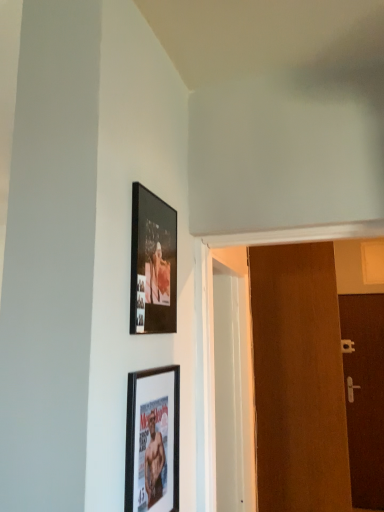
Describe the element at coordinates (364, 395) in the screenshot. I see `brown matte door at right, which appears as the second door when viewed from the left` at that location.

Where is `matte black picture frame at upper center, placed as the 1th picture frame when sorted from top to bottom`? matte black picture frame at upper center, placed as the 1th picture frame when sorted from top to bottom is located at coordinates (153, 264).

Where is `brown matte door at right, which appears as the second door when viewed from the left`? This screenshot has height=512, width=384. brown matte door at right, which appears as the second door when viewed from the left is located at coordinates (364, 395).

Does point (299, 401) come closer to viewer compared to point (154, 317)?

That is False.

From the picture: Is brown wooden door at right, the second door when ordered from right to left, inside or outside of matte black picture frame at upper center, the 2th picture frame in the bottom-to-top sequence?

brown wooden door at right, the second door when ordered from right to left, cannot be found inside matte black picture frame at upper center, the 2th picture frame in the bottom-to-top sequence.

Is brown wooden door at right, positioned as the 1th door in front-to-back order, to the left or to the right of matte black picture frame at upper center, placed as the 1th picture frame when sorted from top to bottom, in the image?

In the image, brown wooden door at right, positioned as the 1th door in front-to-back order, appears on the right side of matte black picture frame at upper center, placed as the 1th picture frame when sorted from top to bottom.

Which of these two, matte black picture frame at upper center, placed as the 1th picture frame when sorted from top to bottom, or matte black picture frame at lower center, marked as the 2th picture frame in a top-to-bottom arrangement, is wider?

With larger width is matte black picture frame at upper center, placed as the 1th picture frame when sorted from top to bottom.

Where is `picture frame that appears below the matte black picture frame at upper center, the 2th picture frame in the bottom-to-top sequence (from a real-world perspective)`? Image resolution: width=384 pixels, height=512 pixels. picture frame that appears below the matte black picture frame at upper center, the 2th picture frame in the bottom-to-top sequence (from a real-world perspective) is located at coordinates (152, 438).

Does matte black picture frame at upper center, the 2th picture frame in the bottom-to-top sequence, have a larger size compared to matte black picture frame at lower center, which is the first picture frame in bottom-to-top order?

Yes.

From the picture: Between matte black picture frame at lower center, marked as the 2th picture frame in a top-to-bottom arrangement, and matte black picture frame at upper center, the 2th picture frame in the bottom-to-top sequence, which one appears on the right side from the viewer's perspective?

Positioned to the right is matte black picture frame at lower center, marked as the 2th picture frame in a top-to-bottom arrangement.

Is the depth of matte black picture frame at lower center, which is the first picture frame in bottom-to-top order, greater than that of matte black picture frame at upper center, placed as the 1th picture frame when sorted from top to bottom?

No, it is in front of matte black picture frame at upper center, placed as the 1th picture frame when sorted from top to bottom.

Which of these two, matte black picture frame at lower center, which is the first picture frame in bottom-to-top order, or matte black picture frame at upper center, the 2th picture frame in the bottom-to-top sequence, is smaller?

matte black picture frame at lower center, which is the first picture frame in bottom-to-top order.

From the picture: Is matte black picture frame at lower center, which is the first picture frame in bottom-to-top order, located outside matte black picture frame at upper center, the 2th picture frame in the bottom-to-top sequence?

Yes, matte black picture frame at lower center, which is the first picture frame in bottom-to-top order, is located beyond the bounds of matte black picture frame at upper center, the 2th picture frame in the bottom-to-top sequence.

Does point (360, 294) appear closer or farther from the camera than point (149, 259)?

Clearly, point (360, 294) is more distant from the camera than point (149, 259).

Can you confirm if brown matte door at right, which appears as the second door when viewed from the left, is wider than matte black picture frame at upper center, placed as the 1th picture frame when sorted from top to bottom?

Indeed, brown matte door at right, which appears as the second door when viewed from the left, has a greater width compared to matte black picture frame at upper center, placed as the 1th picture frame when sorted from top to bottom.

You are a GUI agent. You are given a task and a screenshot of the screen. Output one action in this format:
    pyautogui.click(x=<x>, y=<y>)
    Task: Click on the picture frame that is the 1st one when counting forward from the brown matte door at right, which appears as the second door when viewed from the left
    Image resolution: width=384 pixels, height=512 pixels.
    Given the screenshot: What is the action you would take?
    pyautogui.click(x=153, y=264)

Can you confirm if brown matte door at right, the first door positioned from the right, is bigger than matte black picture frame at upper center, placed as the 1th picture frame when sorted from top to bottom?

Yes, brown matte door at right, the first door positioned from the right, is bigger than matte black picture frame at upper center, placed as the 1th picture frame when sorted from top to bottom.

Is matte black picture frame at upper center, placed as the 1th picture frame when sorted from top to bottom, facing away from brown wooden door at right, positioned as the 1th door in left-to-right order?

No, brown wooden door at right, positioned as the 1th door in left-to-right order, is not at the back of matte black picture frame at upper center, placed as the 1th picture frame when sorted from top to bottom.

Based on their positions, is matte black picture frame at upper center, the 2th picture frame in the bottom-to-top sequence, located to the left or right of brown wooden door at right, the second door when ordered from right to left?

matte black picture frame at upper center, the 2th picture frame in the bottom-to-top sequence, is positioned on brown wooden door at right, the second door when ordered from right to left,'s left side.

Is matte black picture frame at upper center, placed as the 1th picture frame when sorted from top to bottom, surrounding brown wooden door at right, positioned as the 1th door in left-to-right order?

No, matte black picture frame at upper center, placed as the 1th picture frame when sorted from top to bottom, does not contain brown wooden door at right, positioned as the 1th door in left-to-right order.

Measure the distance between matte black picture frame at upper center, placed as the 1th picture frame when sorted from top to bottom, and brown wooden door at right, marked as the 2th door in a back-to-front arrangement.

matte black picture frame at upper center, placed as the 1th picture frame when sorted from top to bottom, is 1.55 meters from brown wooden door at right, marked as the 2th door in a back-to-front arrangement.

The height and width of the screenshot is (512, 384). What are the coordinates of `door that is the 1st one when counting rightward from the matte black picture frame at lower center, marked as the 2th picture frame in a top-to-bottom arrangement` in the screenshot? It's located at (298, 380).

Is matte black picture frame at lower center, which is the first picture frame in bottom-to-top order, shorter than brown wooden door at right, marked as the 2th door in a back-to-front arrangement?

Correct, matte black picture frame at lower center, which is the first picture frame in bottom-to-top order, is not as tall as brown wooden door at right, marked as the 2th door in a back-to-front arrangement.

From the image's perspective, between matte black picture frame at lower center, which is the first picture frame in bottom-to-top order, and brown wooden door at right, the second door when ordered from right to left, who is located below?

brown wooden door at right, the second door when ordered from right to left, is shown below in the image.

Is matte black picture frame at lower center, which is the first picture frame in bottom-to-top order, behind brown wooden door at right, positioned as the 1th door in front-to-back order?

No.

Is brown matte door at right, which appears as the second door when viewed from the left, directly adjacent to matte black picture frame at lower center, which is the first picture frame in bottom-to-top order?

brown matte door at right, which appears as the second door when viewed from the left, is not next to matte black picture frame at lower center, which is the first picture frame in bottom-to-top order, and they're not touching.

Is brown matte door at right, the first door positioned from the right, spatially inside matte black picture frame at lower center, which is the first picture frame in bottom-to-top order, or outside of it?

brown matte door at right, the first door positioned from the right, cannot be found inside matte black picture frame at lower center, which is the first picture frame in bottom-to-top order.

Identify the location of door below the matte black picture frame at lower center, marked as the 2th picture frame in a top-to-bottom arrangement (from a real-world perspective). This screenshot has width=384, height=512. (364, 395).

Who is bigger, brown matte door at right, positioned as the second door in front-to-back order, or matte black picture frame at lower center, marked as the 2th picture frame in a top-to-bottom arrangement?

Bigger between the two is brown matte door at right, positioned as the second door in front-to-back order.

Identify the location of door that is the 1st object to the right of the matte black picture frame at upper center, placed as the 1th picture frame when sorted from top to bottom, starting at the anchor. Image resolution: width=384 pixels, height=512 pixels. (298, 380).

You are a GUI agent. You are given a task and a screenshot of the screen. Output one action in this format:
    pyautogui.click(x=<x>, y=<y>)
    Task: Click on the picture frame that is under the matte black picture frame at upper center, placed as the 1th picture frame when sorted from top to bottom (from a real-world perspective)
    This screenshot has height=512, width=384.
    Given the screenshot: What is the action you would take?
    pyautogui.click(x=152, y=438)

Considering their positions, is brown matte door at right, which appears as the second door when viewed from the left, positioned further to matte black picture frame at upper center, the 2th picture frame in the bottom-to-top sequence, than brown wooden door at right, the second door when ordered from right to left?

brown matte door at right, which appears as the second door when viewed from the left, is positioned further to the anchor matte black picture frame at upper center, the 2th picture frame in the bottom-to-top sequence.

Estimate the real-world distances between objects in this image. Which object is further from matte black picture frame at upper center, the 2th picture frame in the bottom-to-top sequence, matte black picture frame at lower center, marked as the 2th picture frame in a top-to-bottom arrangement, or brown wooden door at right, positioned as the 1th door in left-to-right order?

Among the two, brown wooden door at right, positioned as the 1th door in left-to-right order, is located further to matte black picture frame at upper center, the 2th picture frame in the bottom-to-top sequence.

When comparing their distances from matte black picture frame at upper center, the 2th picture frame in the bottom-to-top sequence, does brown matte door at right, arranged as the 1th door when viewed from the back, or matte black picture frame at lower center, which is the first picture frame in bottom-to-top order, seem further?

brown matte door at right, arranged as the 1th door when viewed from the back, is positioned further to the anchor matte black picture frame at upper center, the 2th picture frame in the bottom-to-top sequence.

Based on their spatial positions, is brown wooden door at right, positioned as the 1th door in left-to-right order, or matte black picture frame at upper center, placed as the 1th picture frame when sorted from top to bottom, closer to brown matte door at right, arranged as the 1th door when viewed from the back?

brown wooden door at right, positioned as the 1th door in left-to-right order.

When comparing their distances from brown matte door at right, positioned as the second door in front-to-back order, does matte black picture frame at lower center, which is the first picture frame in bottom-to-top order, or matte black picture frame at upper center, the 2th picture frame in the bottom-to-top sequence, seem closer?

matte black picture frame at lower center, which is the first picture frame in bottom-to-top order.

Estimate the real-world distances between objects in this image. Which object is closer to matte black picture frame at lower center, which is the first picture frame in bottom-to-top order, matte black picture frame at upper center, placed as the 1th picture frame when sorted from top to bottom, or brown matte door at right, which appears as the second door when viewed from the left?

matte black picture frame at upper center, placed as the 1th picture frame when sorted from top to bottom.

Based on their spatial positions, is matte black picture frame at upper center, placed as the 1th picture frame when sorted from top to bottom, or brown wooden door at right, positioned as the 1th door in left-to-right order, further from matte black picture frame at lower center, marked as the 2th picture frame in a top-to-bottom arrangement?

brown wooden door at right, positioned as the 1th door in left-to-right order, is positioned further to the anchor matte black picture frame at lower center, marked as the 2th picture frame in a top-to-bottom arrangement.

Looking at the image, which one is located further to brown matte door at right, positioned as the second door in front-to-back order, brown wooden door at right, positioned as the 1th door in front-to-back order, or matte black picture frame at lower center, which is the first picture frame in bottom-to-top order?

matte black picture frame at lower center, which is the first picture frame in bottom-to-top order, is positioned further to the anchor brown matte door at right, positioned as the second door in front-to-back order.

The height and width of the screenshot is (512, 384). In order to click on picture frame between matte black picture frame at lower center, marked as the 2th picture frame in a top-to-bottom arrangement, and brown wooden door at right, the second door when ordered from right to left, from front to back in this screenshot , I will do `click(153, 264)`.

Find the location of a particular element. This screenshot has width=384, height=512. door between matte black picture frame at lower center, which is the first picture frame in bottom-to-top order, and brown matte door at right, arranged as the 1th door when viewed from the back, from front to back is located at coordinates (298, 380).

The width and height of the screenshot is (384, 512). I want to click on door between matte black picture frame at upper center, placed as the 1th picture frame when sorted from top to bottom, and brown matte door at right, positioned as the second door in front-to-back order, in the front-back direction, so click(x=298, y=380).

Where is `picture frame between matte black picture frame at lower center, which is the first picture frame in bottom-to-top order, and brown matte door at right, the first door positioned from the right, from front to back`? picture frame between matte black picture frame at lower center, which is the first picture frame in bottom-to-top order, and brown matte door at right, the first door positioned from the right, from front to back is located at coordinates (153, 264).